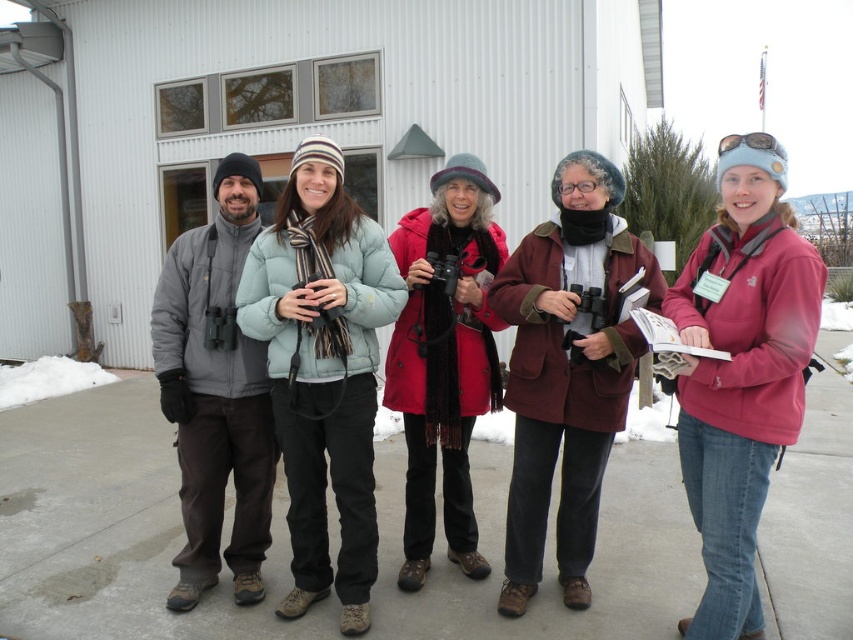
Question: Considering the real-world distances, which object is farthest from the light blue down jacket at center?

Choices:
 (A) matte gray jacket at left
 (B) maroon woolen coat at center
 (C) red matte coat at center
 (D) pink softshell jacket at center

Answer: (D)

Question: Does maroon woolen coat at center have a greater width compared to matte gray jacket at left?

Choices:
 (A) yes
 (B) no

Answer: (A)

Question: Which of the following is the closest to the observer?

Choices:
 (A) matte gray jacket at left
 (B) maroon woolen coat at center
 (C) pink softshell jacket at center
 (D) light blue down jacket at center

Answer: (C)

Question: Which of these objects is positioned closest to the pink softshell jacket at center?

Choices:
 (A) light blue down jacket at center
 (B) maroon woolen coat at center
 (C) red matte coat at center
 (D) matte gray jacket at left

Answer: (B)

Question: Does light blue down jacket at center appear on the left side of maroon woolen coat at center?

Choices:
 (A) yes
 (B) no

Answer: (A)

Question: Is maroon woolen coat at center below matte gray jacket at left?

Choices:
 (A) yes
 (B) no

Answer: (A)